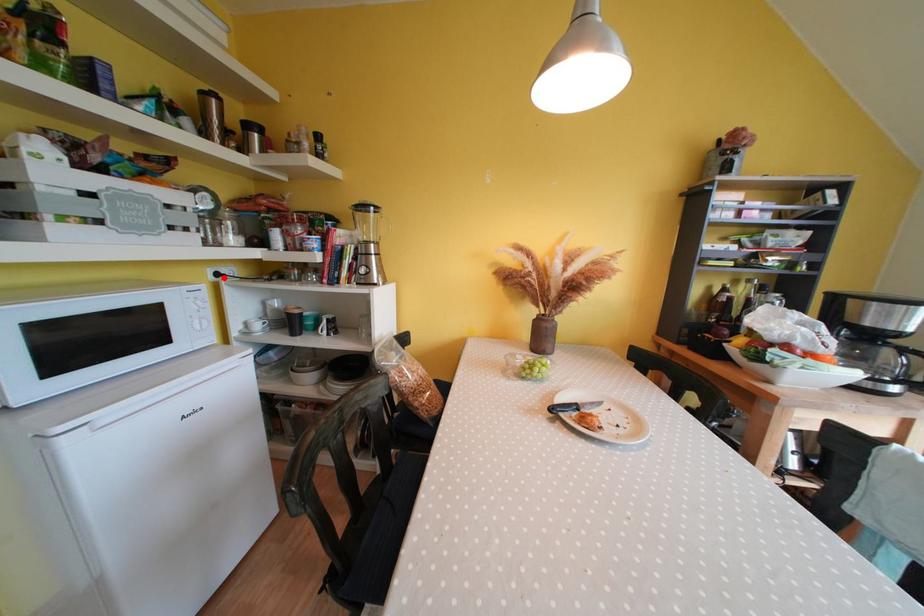
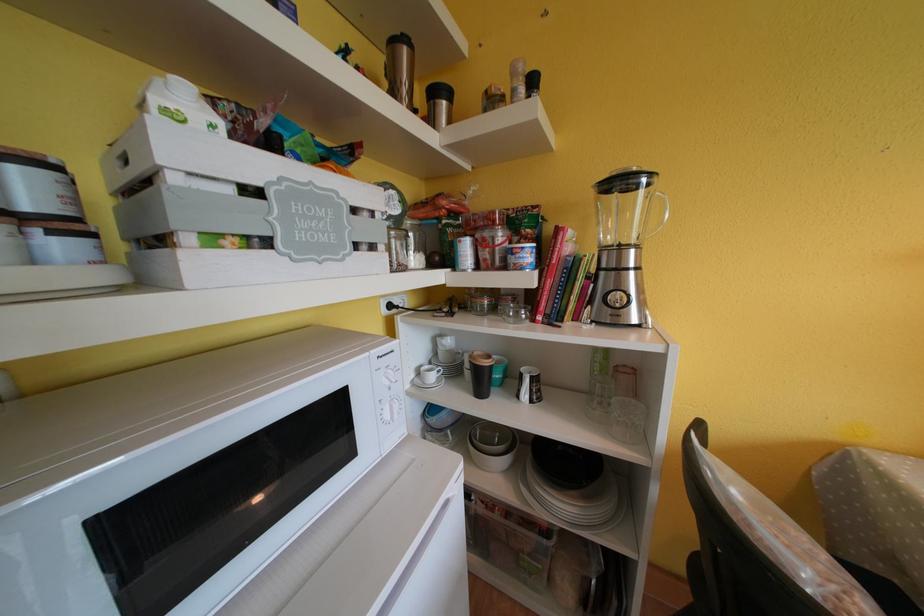
Where in the second image is the point corresponding to the highlighted location from the first image?

(396, 310)